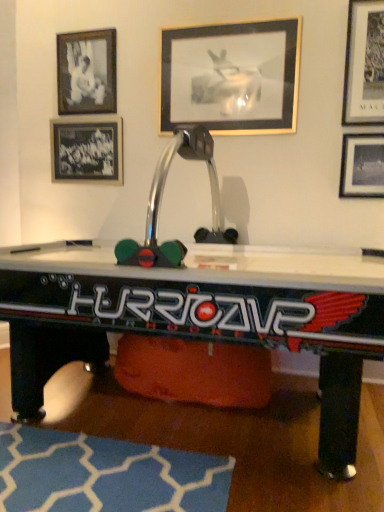
Find the location of a particular element. The height and width of the screenshot is (512, 384). vacant space to the right of blue fabric rug at lower center is located at coordinates (272, 450).